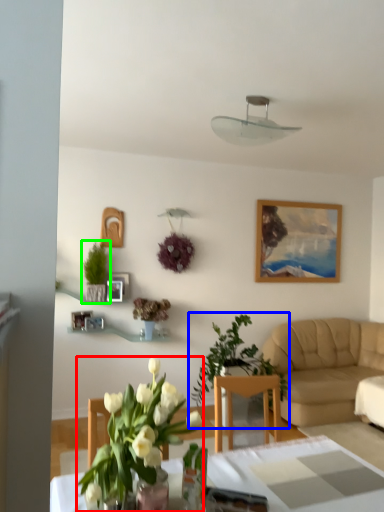
Question: Which object is the closest to the houseplant (highlighted by a red box)? Choose among these: houseplant (highlighted by a blue box) or houseplant (highlighted by a green box).

Choices:
 (A) houseplant
 (B) houseplant

Answer: (A)